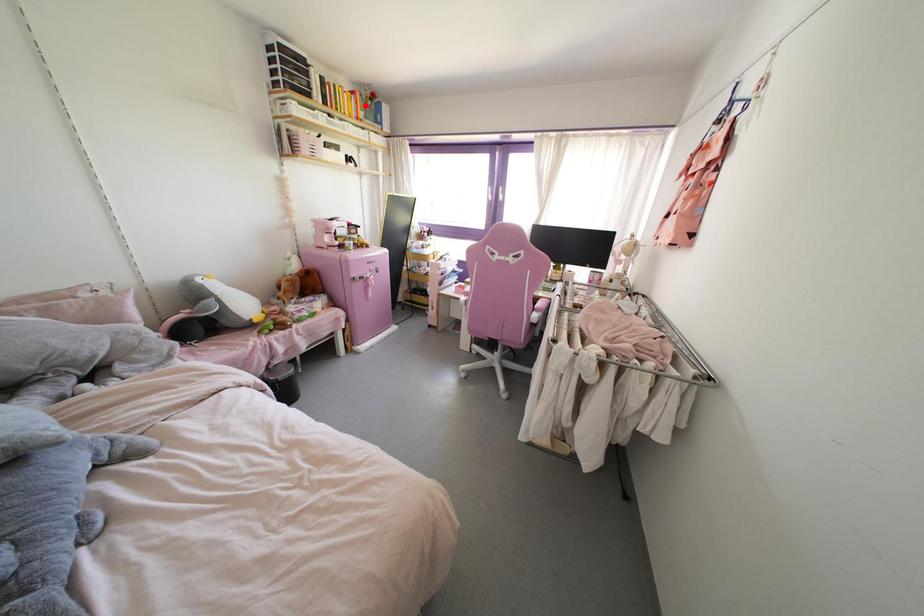
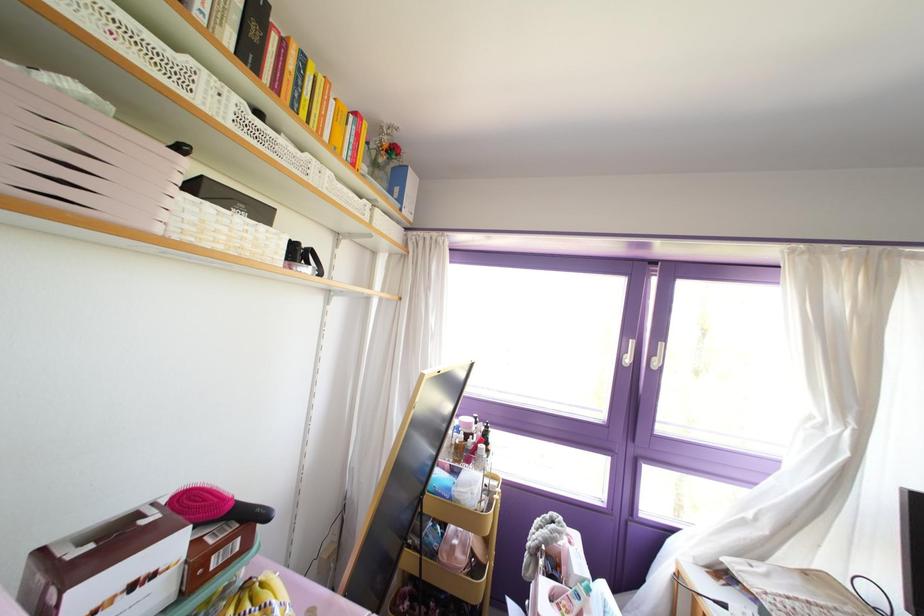
Where in the second image is the point corresponding to the highlighted location from the first image?

(372, 163)